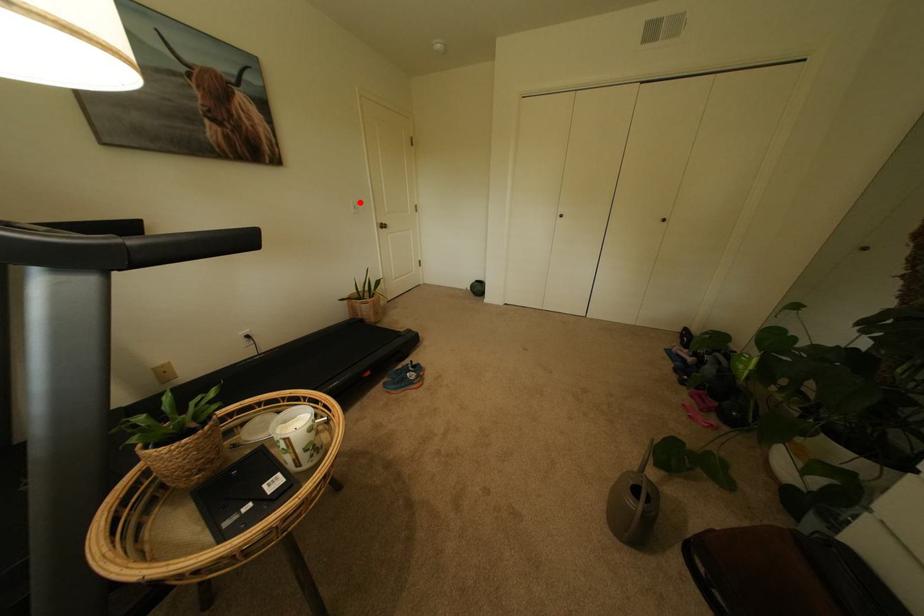
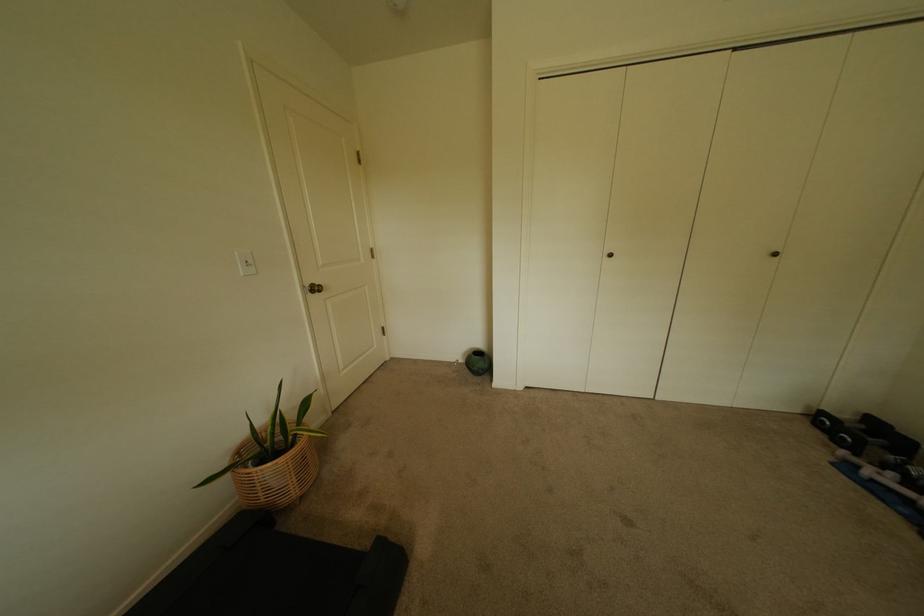
The point at the highlighted location is marked in the first image. Where is the corresponding point in the second image?

(245, 254)